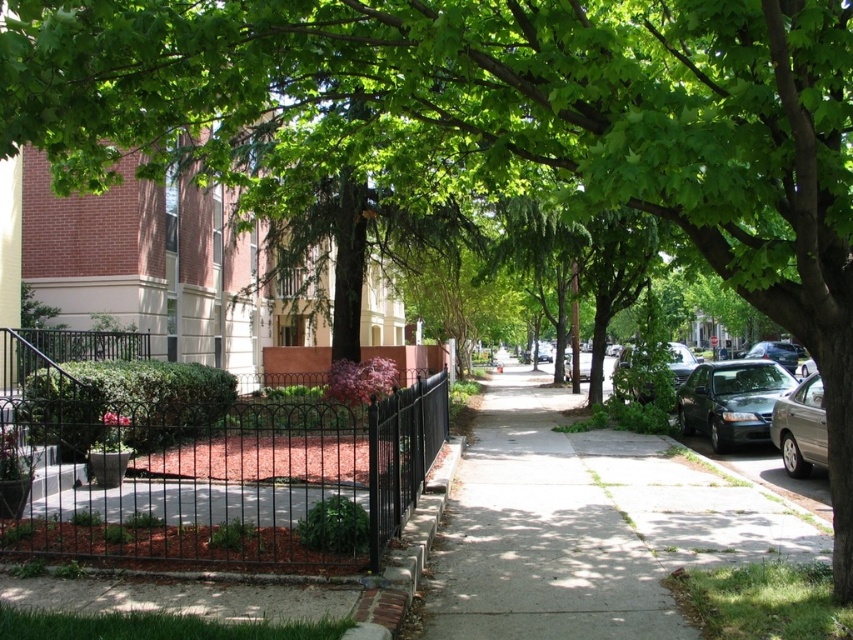
Question: Is smooth concrete sidewalk at center to the right of shiny silver sedan at center right from the viewer's perspective?

Choices:
 (A) yes
 (B) no

Answer: (B)

Question: Which of the following is the farthest from the observer?

Choices:
 (A) smooth concrete sidewalk at center
 (B) shiny silver sedan at right

Answer: (B)

Question: Is black wrought iron fence at lower left in front of shiny silver sedan at center right?

Choices:
 (A) no
 (B) yes

Answer: (B)

Question: Is black wrought iron fence at lower left above shiny silver sedan at center right?

Choices:
 (A) yes
 (B) no

Answer: (B)

Question: Estimate the real-world distances between objects in this image. Which object is closer to the smooth concrete sidewalk at center?

Choices:
 (A) silver metallic sedan at right
 (B) shiny silver sedan at center right
 (C) shiny black sedan at right

Answer: (C)

Question: Which is farther from the shiny silver sedan at center right?

Choices:
 (A) silver metallic sedan at right
 (B) shiny silver sedan at right
 (C) black wrought iron fence at lower left
 (D) shiny black sedan at right

Answer: (B)